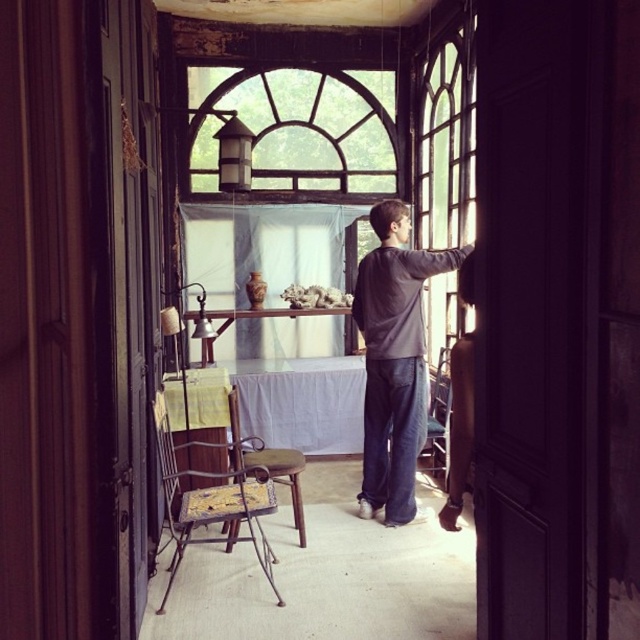
Question: Which is farther from the white sheer curtain at center?

Choices:
 (A) clear glass window at center
 (B) white cloth at center
 (C) rusty metal chair at lower left

Answer: (C)

Question: Does clear glass window at center appear on the left side of rusty metal chair at lower left?

Choices:
 (A) yes
 (B) no

Answer: (B)

Question: In this image, where is clear glass window at center located relative to metallic wire chair at center?

Choices:
 (A) below
 (B) above

Answer: (B)

Question: Is clear glass window at center below metallic wire chair at center?

Choices:
 (A) yes
 (B) no

Answer: (B)

Question: Which point appears closest to the camera in this image?

Choices:
 (A) (436, 388)
 (B) (230, 456)

Answer: (B)

Question: Considering the real-world distances, which object is closest to the clear glass window at center?

Choices:
 (A) white sheer curtain at center
 (B) wooden textured chair at center
 (C) white cloth at center
 (D) metallic wire chair at center

Answer: (D)